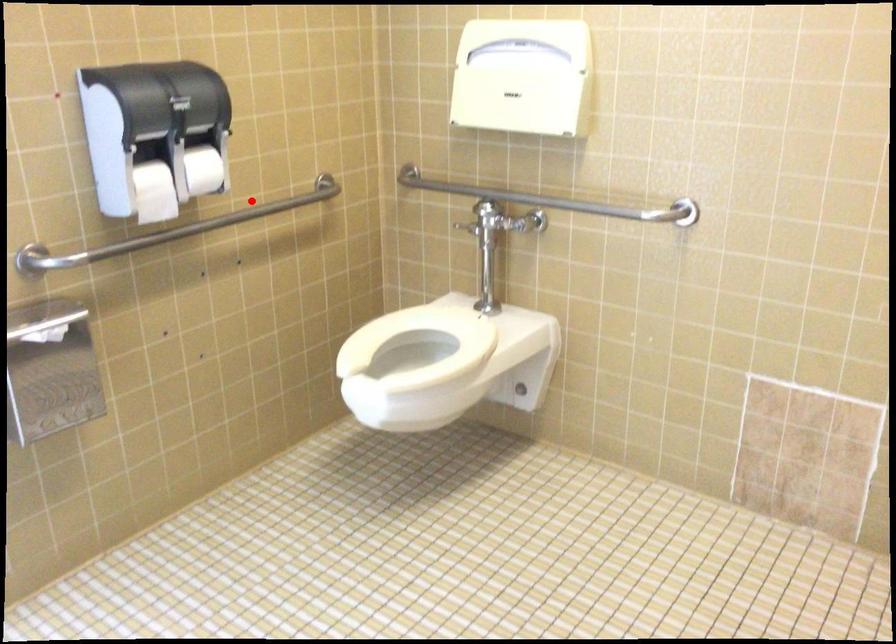
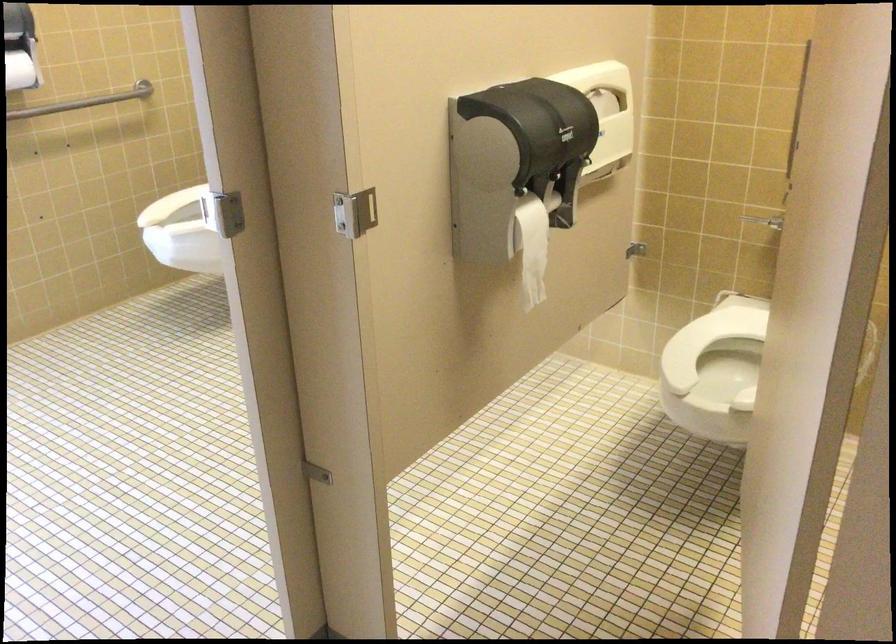
The point at the highlighted location is marked in the first image. Where is the corresponding point in the second image?

(83, 102)